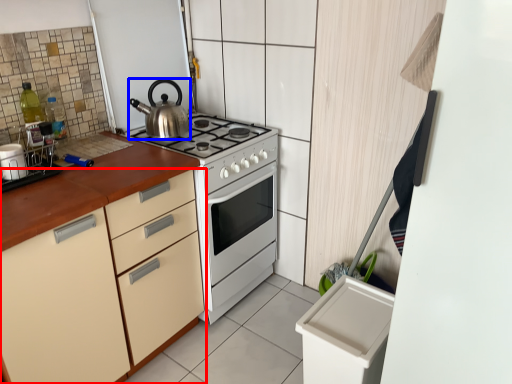
Question: Among these objects, which one is nearest to the camera, cabinetry (highlighted by a red box) or kettle (highlighted by a blue box)?

Choices:
 (A) cabinetry
 (B) kettle

Answer: (A)